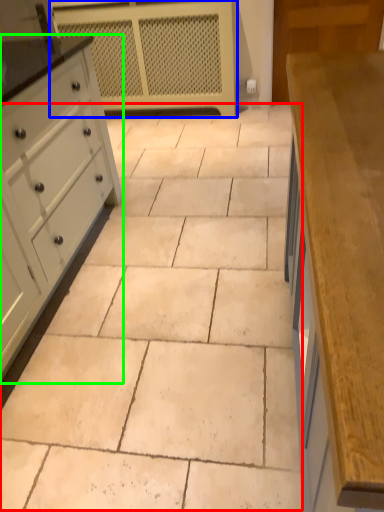
Question: Which object is positioned farthest from ceramic tile (highlighted by a red box)? Select from appliance (highlighted by a blue box) and chest of drawers (highlighted by a green box).

Choices:
 (A) appliance
 (B) chest of drawers

Answer: (A)